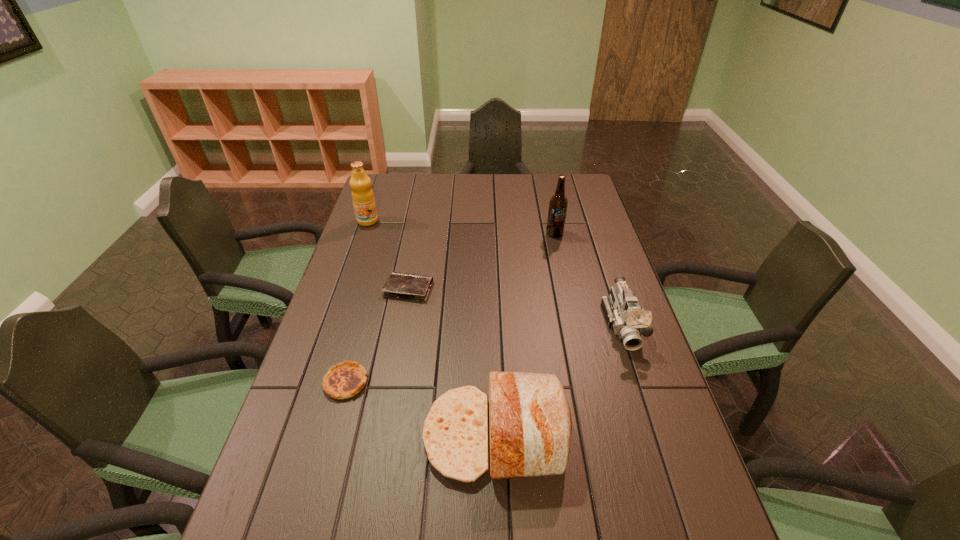
At what (x,y) coordinates should I click in order to perform the action: click on vacant space at the far edge of the desktop. Please return your answer as a coordinate pair (x, y). The image size is (960, 540). Looking at the image, I should click on (422, 184).

In the image, there is a desktop. Where is `vacant region at the left edge`? The image size is (960, 540). vacant region at the left edge is located at coordinates (261, 527).

Where is `blank space at the right edge of the desktop`? blank space at the right edge of the desktop is located at coordinates (614, 262).

Locate an element on the screen. The width and height of the screenshot is (960, 540). vacant region at the far right corner of the desktop is located at coordinates (587, 195).

The height and width of the screenshot is (540, 960). I want to click on free space between the quiche and the second object from right to left, so click(x=450, y=308).

Find the location of a particular element. The image size is (960, 540). free space between the fruit juice and the third object from right to left is located at coordinates (431, 328).

Locate an element on the screen. The width and height of the screenshot is (960, 540). vacant space that is in between the bread and the farthest object is located at coordinates (431, 328).

Image resolution: width=960 pixels, height=540 pixels. In order to click on free space between the rightmost object and the quiche in this screenshot , I will do `click(485, 354)`.

Where is `free space that is in between the diary and the farthest object`? The width and height of the screenshot is (960, 540). free space that is in between the diary and the farthest object is located at coordinates (388, 255).

Identify the location of free space between the fifth object from left to right and the diary. The image size is (960, 540). (482, 261).